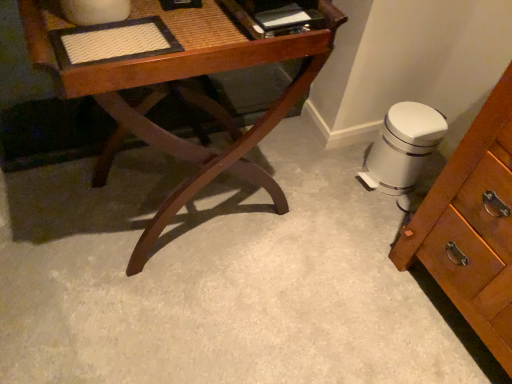
You are a GUI agent. You are given a task and a screenshot of the screen. Output one action in this format:
    pyautogui.click(x=<x>, y=<y>)
    Task: Click on the free location to the left of white glossy trash can at lower right
    The height and width of the screenshot is (384, 512).
    Given the screenshot: What is the action you would take?
    pyautogui.click(x=333, y=165)